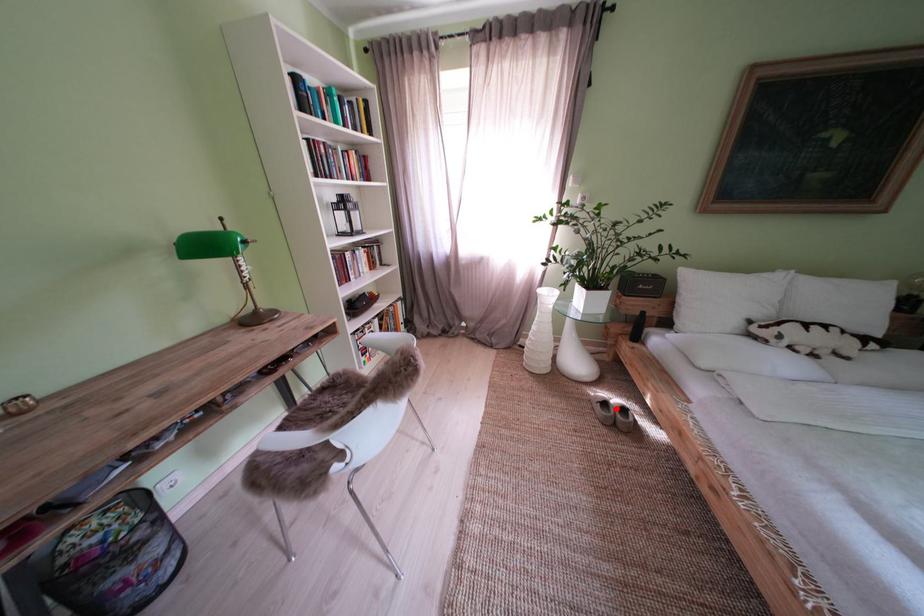
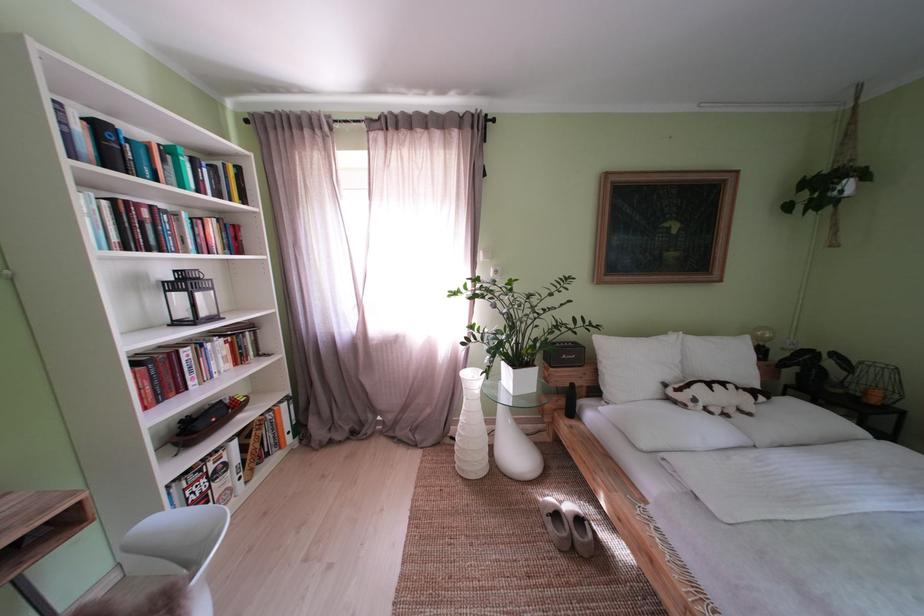
Question: I am providing you with two images of the same scene from different viewpoints. Given a red point in image1, look at the same physical point in image2. Is it:

Choices:
 (A) Closer to the viewpoint
 (B) Farther from the viewpoint

Answer: (B)